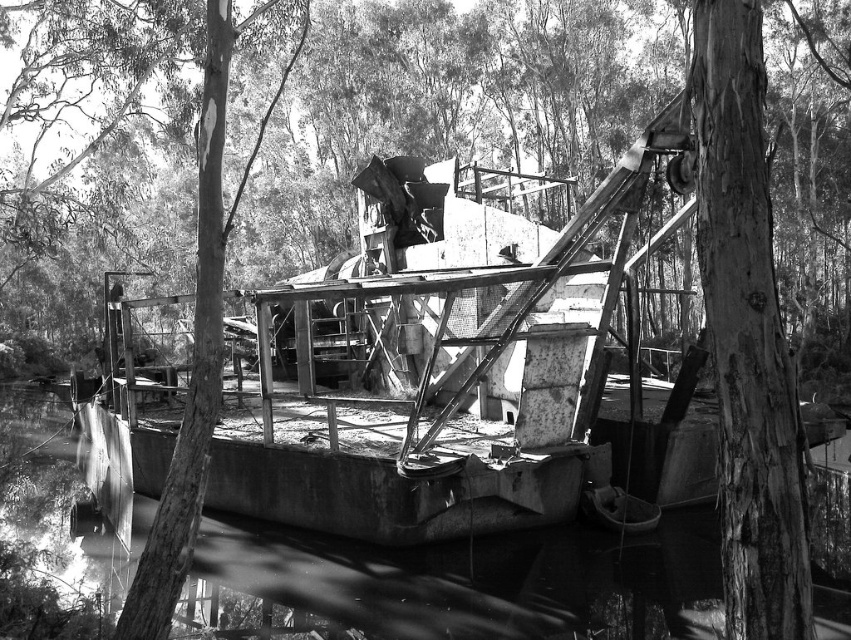
You are a hiker who wants to cross the smooth concrete river at center using the rough bark tree at center. Is the tree positioned in a way that allows you to step onto the tree from the river?

The rough bark tree at center is located above the smooth concrete river at center, so yes, you can step onto the tree from the river.

You are a hiker who wants to cross the smooth concrete river at center. There is a rough bark tree at center nearby. Can you use the tree to help you cross the river safely?

The rough bark tree at center is taller than the smooth concrete river at center, so you can climb the rough bark tree at center to get a better view of the river and plan a safe crossing route.

You are standing at the point marked by the coordinates point (431, 104) in the image. Looking around, you see a rough bark tree at center. What object is located at your current position?

The rough bark tree at center is located at point (431, 104).